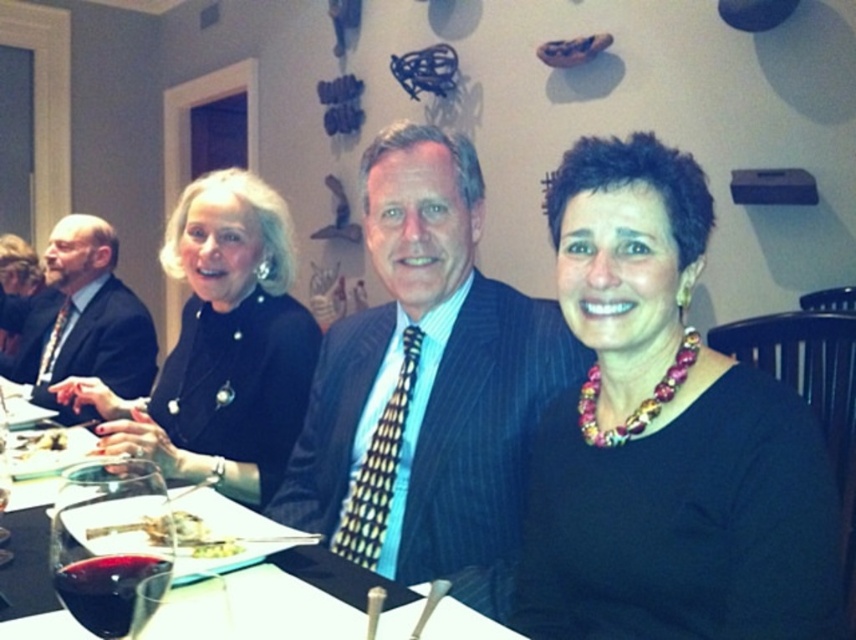
From the picture: You are a photographer positioned behind the camera. You notice the matte black suit at left and the white creamy food at lower left in your frame. Which object is closer to you?

The matte black suit at left is closer to you because it is further to the viewer than the white creamy food at lower left.

Consider the image. You are a photographer taking a picture of the group at the dining table. You notice the multicolored beaded necklace at center and the pinstriped suit at center. Which item is closer to the camera?

The multicolored beaded necklace at center is closer to the camera because it is in front of the pinstriped suit at center.